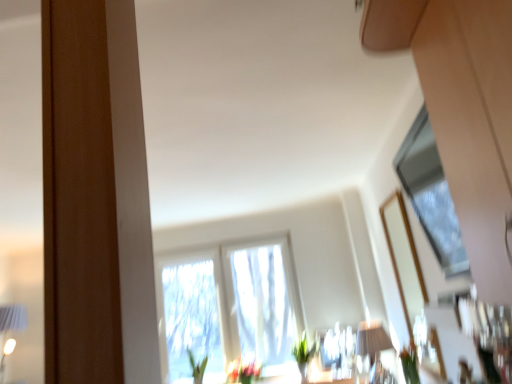
Question: Is matte white table lamp at lower center positioned far away from green matte vase at lower center, the 2th plant from the top?

Choices:
 (A) no
 (B) yes

Answer: (A)

Question: Can you confirm if matte white table lamp at lower center is shorter than green matte vase at lower center, which ranks as the first plant in bottom-to-top order?

Choices:
 (A) no
 (B) yes

Answer: (A)

Question: Is matte white table lamp at lower center thinner than green matte vase at lower center, which ranks as the first plant in bottom-to-top order?

Choices:
 (A) yes
 (B) no

Answer: (B)

Question: Is matte white table lamp at lower center closer to the viewer compared to green matte vase at lower center, which ranks as the first plant in bottom-to-top order?

Choices:
 (A) yes
 (B) no

Answer: (A)

Question: Does matte white table lamp at lower center come behind green matte vase at lower center, the 2th plant from the top?

Choices:
 (A) no
 (B) yes

Answer: (A)

Question: Is matte white table lamp at lower center touching green matte vase at lower center, the second plant positioned from the front?

Choices:
 (A) no
 (B) yes

Answer: (A)

Question: From the image's perspective, is transparent glass window at upper right, the 1th window when ordered from top to bottom, located beneath translucent fabric window at center, which is the second window from front to back?

Choices:
 (A) yes
 (B) no

Answer: (B)

Question: Can you confirm if transparent glass window at upper right, arranged as the 1th window when viewed from the right, is bigger than translucent fabric window at center, the second window in the top-to-bottom sequence?

Choices:
 (A) no
 (B) yes

Answer: (A)

Question: Is transparent glass window at upper right, arranged as the 1th window when viewed from the right, smaller than translucent fabric window at center, arranged as the 1th window when ordered from the bottom?

Choices:
 (A) no
 (B) yes

Answer: (B)

Question: From a real-world perspective, is transparent glass window at upper right, which appears as the first window when viewed from the front, beneath translucent fabric window at center, the second window in the top-to-bottom sequence?

Choices:
 (A) no
 (B) yes

Answer: (A)

Question: Can we say transparent glass window at upper right, the second window in the back-to-front sequence, lies outside translucent fabric window at center, the second window in the top-to-bottom sequence?

Choices:
 (A) yes
 (B) no

Answer: (A)

Question: Are transparent glass window at upper right, arranged as the 1th window when viewed from the right, and translucent fabric window at center, the 1th window in the back-to-front sequence, making contact?

Choices:
 (A) no
 (B) yes

Answer: (A)

Question: Can you confirm if green matte plant at lower right, which is the 2th plant from left to right, is wider than translucent fabric window at center, the 2th window positioned from the right?

Choices:
 (A) yes
 (B) no

Answer: (A)